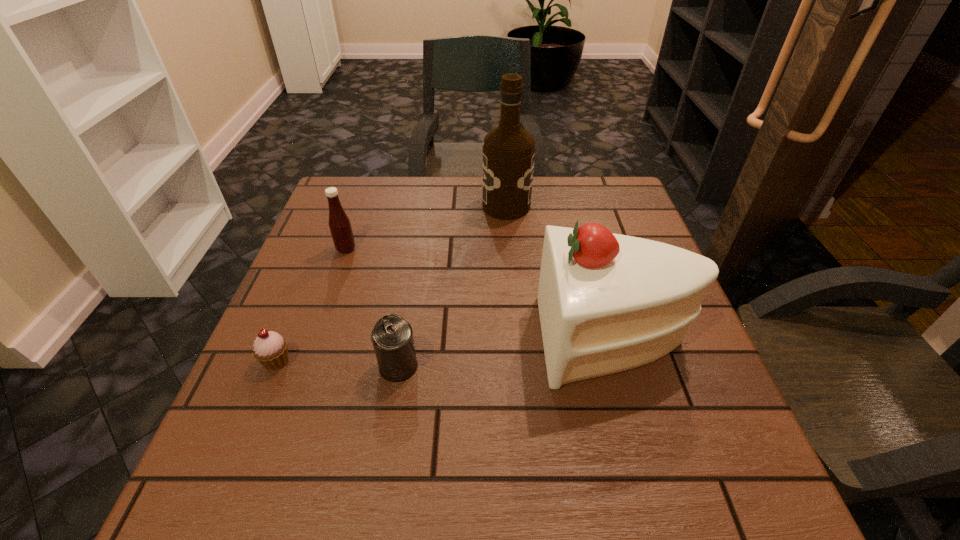
Find the location of a particular element. vacant space at the far edge is located at coordinates (444, 191).

Find the location of a particular element. free space at the near edge is located at coordinates (476, 468).

This screenshot has width=960, height=540. In the image, there is a desktop. Identify the location of vacant space at the left edge. (336, 255).

Identify the location of vacant region at the far left corner of the desktop. (387, 178).

Where is `vacant space at the near left corner`? This screenshot has width=960, height=540. vacant space at the near left corner is located at coordinates (204, 512).

Locate an element on the screen. The image size is (960, 540). vacant area that lies between the third shortest object and the tallest object is located at coordinates 426,227.

The image size is (960, 540). In order to click on free space that is in between the fourth nearest object and the shortest object in this screenshot , I will do `click(311, 305)`.

Find the location of a particular element. vacant space that is in between the second farthest object and the second tallest object is located at coordinates (480, 294).

Locate an element on the screen. The image size is (960, 540). free area in between the second shortest object and the fourth nearest object is located at coordinates (372, 307).

At what (x,y) coordinates should I click in order to perform the action: click on free spot between the second tallest object and the can. Please return your answer as a coordinate pair (x, y). Image resolution: width=960 pixels, height=540 pixels. Looking at the image, I should click on (506, 352).